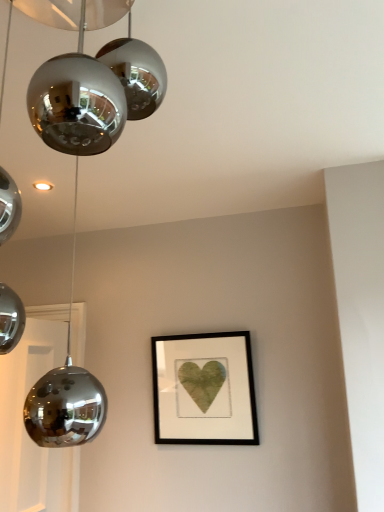
The image size is (384, 512). Describe the element at coordinates (89, 94) in the screenshot. I see `polished chrome globe at upper left` at that location.

In order to face polished chrome globe at upper left, should I rotate leftwards or rightwards?

To face it directly, rotate left by 21.093 degrees.

Where is `polished chrome globe at upper left`? The height and width of the screenshot is (512, 384). polished chrome globe at upper left is located at coordinates (89, 94).

This screenshot has height=512, width=384. In order to click on matte black frame at center in this screenshot , I will do `click(204, 389)`.

Measure the distance between matte black frame at center and camera.

matte black frame at center is 6.82 feet away from camera.

Describe the element at coordinates (204, 389) in the screenshot. The image size is (384, 512). I see `matte black frame at center` at that location.

Where is `polished chrome globe at upper left`? The image size is (384, 512). polished chrome globe at upper left is located at coordinates (89, 94).

Which object is positioned more to the left, polished chrome globe at upper left or matte black frame at center?

polished chrome globe at upper left is more to the left.

Is polished chrome globe at upper left in front of or behind matte black frame at center in the image?

Visually, polished chrome globe at upper left is located in front of matte black frame at center.

From the picture: Which point is more forward, (45,382) or (157,343)?

Positioned in front is point (45,382).

From the image's perspective, which object appears higher, polished chrome globe at upper left or matte black frame at center?

polished chrome globe at upper left.

From a real-world perspective, relative to matte black frame at center, is polished chrome globe at upper left vertically above or below?

In terms of real-world spatial position, polished chrome globe at upper left is above matte black frame at center.

In the scene shown: Is polished chrome globe at upper left thinner than matte black frame at center?

Incorrect, the width of polished chrome globe at upper left is not less than that of matte black frame at center.

Between polished chrome globe at upper left and matte black frame at center, which one has more height?

polished chrome globe at upper left is taller.

Does polished chrome globe at upper left have a larger size compared to matte black frame at center?

Yes.

Is polished chrome globe at upper left inside the boundaries of matte black frame at center, or outside?

polished chrome globe at upper left is spatially situated outside matte black frame at center.

Is polished chrome globe at upper left in contact with matte black frame at center?

polished chrome globe at upper left is not next to matte black frame at center, and they're not touching.

Is polished chrome globe at upper left facing towards matte black frame at center?

No.

How many degrees apart are the facing directions of polished chrome globe at upper left and matte black frame at center?

The angular difference between polished chrome globe at upper left and matte black frame at center is 89 degrees.

How far apart are polished chrome globe at upper left and matte black frame at center?

A distance of 1.46 meters exists between polished chrome globe at upper left and matte black frame at center.

Where is `picture frame below the polished chrome globe at upper left (from the image's perspective)`? This screenshot has height=512, width=384. picture frame below the polished chrome globe at upper left (from the image's perspective) is located at coordinates (204, 389).

Which is more to the left, matte black frame at center or polished chrome globe at upper left?

polished chrome globe at upper left is more to the left.

Consider the image. Is matte black frame at center further to camera compared to polished chrome globe at upper left?

That is True.

Is point (199, 439) farther from camera compared to point (82, 108)?

That is True.

From the image's perspective, is matte black frame at center positioned above or below polished chrome globe at upper left?

Based on their image positions, matte black frame at center is located beneath polished chrome globe at upper left.

From a real-world perspective, is matte black frame at center physically above polished chrome globe at upper left?

No, from a real-world perspective, matte black frame at center is not over polished chrome globe at upper left

Based on the photo, considering the relative sizes of matte black frame at center and polished chrome globe at upper left in the image provided, is matte black frame at center wider than polished chrome globe at upper left?

No, matte black frame at center is not wider than polished chrome globe at upper left.

Consider the image. Who is shorter, matte black frame at center or polished chrome globe at upper left?

With less height is matte black frame at center.

Considering the relative sizes of matte black frame at center and polished chrome globe at upper left in the image provided, is matte black frame at center bigger than polished chrome globe at upper left?

Actually, matte black frame at center might be smaller than polished chrome globe at upper left.

Is matte black frame at center surrounding polished chrome globe at upper left?

Actually, polished chrome globe at upper left is outside matte black frame at center.

Is matte black frame at center directly adjacent to polished chrome globe at upper left?

No, matte black frame at center is not in contact with polished chrome globe at upper left.

Is matte black frame at center aimed at polished chrome globe at upper left?

Yes, matte black frame at center is oriented towards polished chrome globe at upper left.

The width and height of the screenshot is (384, 512). What are the coordinates of `picture frame below the polished chrome globe at upper left (from the image's perspective)` in the screenshot? It's located at (204, 389).

You are a GUI agent. You are given a task and a screenshot of the screen. Output one action in this format:
    pyautogui.click(x=<x>, y=<y>)
    Task: Click on the lamp on the left of matte black frame at center
    The image size is (384, 512).
    Given the screenshot: What is the action you would take?
    pyautogui.click(x=89, y=94)

Where is `picture frame below the polished chrome globe at upper left (from a real-world perspective)`? picture frame below the polished chrome globe at upper left (from a real-world perspective) is located at coordinates (204, 389).